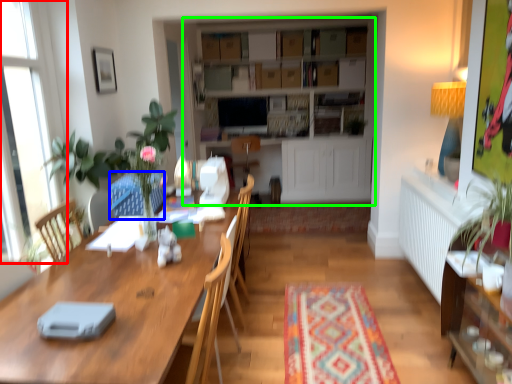
Question: Estimate the real-world distances between objects in this image. Which object is farther from window (highlighted by a red box), swivel chair (highlighted by a blue box) or entertainment center (highlighted by a green box)?

Choices:
 (A) swivel chair
 (B) entertainment center

Answer: (B)